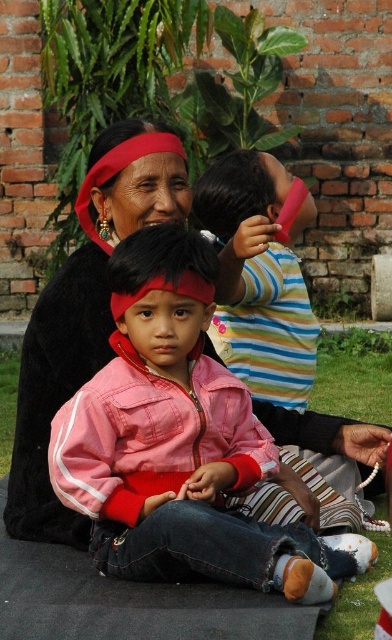
Question: Does pink fabric jacket at center have a greater width compared to striped cotton shirt at upper center?

Choices:
 (A) no
 (B) yes

Answer: (B)

Question: Which object is closer to the camera taking this photo?

Choices:
 (A) striped cotton shirt at upper center
 (B) pink fabric jacket at center

Answer: (B)

Question: Does pink fabric jacket at center appear over striped cotton shirt at upper center?

Choices:
 (A) yes
 (B) no

Answer: (B)

Question: Can you confirm if pink fabric jacket at center is bigger than striped cotton shirt at upper center?

Choices:
 (A) no
 (B) yes

Answer: (B)

Question: Which of the following is the farthest from the observer?

Choices:
 (A) (219, 220)
 (B) (148, 426)

Answer: (A)